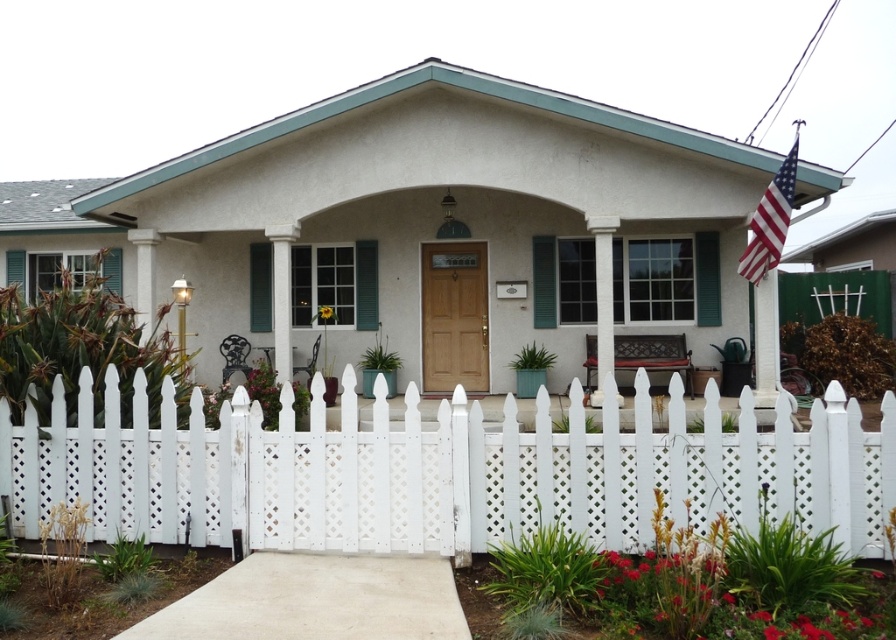
Question: Estimate the real-world distances between objects in this image. Which object is farther from the american flag at upper right?

Choices:
 (A) white picket fence at center
 (B) white painted wood column at center

Answer: (A)

Question: Which point is farther from the camera taking this photo?

Choices:
 (A) (757, 262)
 (B) (194, 516)
 (C) (609, 333)

Answer: (C)

Question: Can you confirm if white picket fence at center is bigger than white painted wood column at center?

Choices:
 (A) no
 (B) yes

Answer: (B)

Question: Is american flag at upper right wider than white painted wood column at center?

Choices:
 (A) no
 (B) yes

Answer: (B)

Question: Does white picket fence at center have a lesser width compared to american flag at upper right?

Choices:
 (A) no
 (B) yes

Answer: (B)

Question: Which object is farther from the camera taking this photo?

Choices:
 (A) white picket fence at center
 (B) american flag at upper right
 (C) white painted wood column at center

Answer: (C)